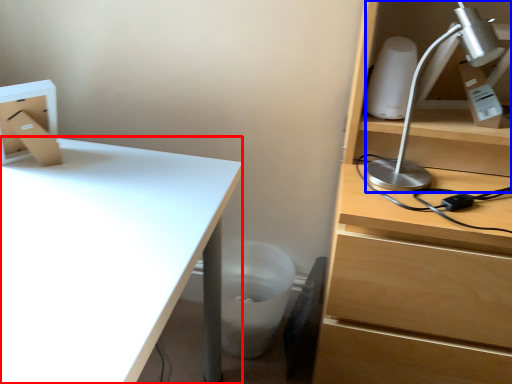
Question: Among these objects, which one is farthest to the camera, desk (highlighted by a red box) or lamp (highlighted by a blue box)?

Choices:
 (A) desk
 (B) lamp

Answer: (B)